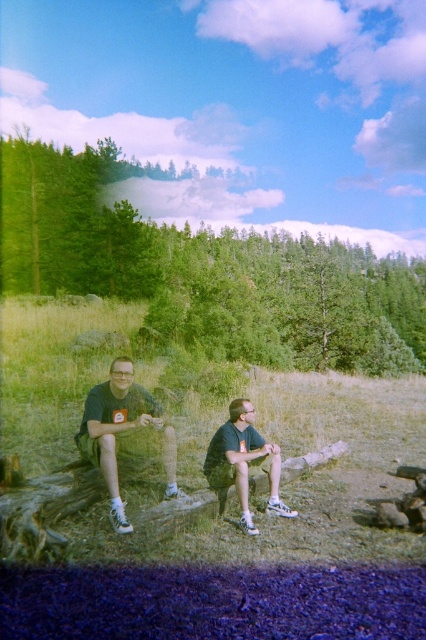
Is green leafy tree at upper left below matte black t-shirt at left?

Actually, green leafy tree at upper left is above matte black t-shirt at left.

Who is lower down, green leafy tree at upper left or matte black t-shirt at left?

matte black t-shirt at left is below.

This screenshot has height=640, width=426. In order to click on green leafy tree at upper left in this screenshot , I will do `click(199, 268)`.

Who is shorter, matte black t-shirt at left or dark green fabric shirt at center?

dark green fabric shirt at center is shorter.

Who is taller, matte black t-shirt at left or dark green fabric shirt at center?

With more height is matte black t-shirt at left.

Looking at this image, measure the distance between point (172,486) and camera.

Point (172,486) is 5.72 meters away from camera.

At what (x,y) coordinates should I click in order to perform the action: click on matte black t-shirt at left. Please return your answer as a coordinate pair (x, y). The height and width of the screenshot is (640, 426). Looking at the image, I should click on (123, 433).

Is green leafy tree at upper left smaller than dark green fabric shorts at center?

Actually, green leafy tree at upper left might be larger than dark green fabric shorts at center.

Between green leafy tree at upper left and dark green fabric shorts at center, which one is positioned higher?

green leafy tree at upper left is higher up.

The image size is (426, 640). In order to click on green leafy tree at upper left in this screenshot , I will do `click(199, 268)`.

Where is `green leafy tree at upper left`? green leafy tree at upper left is located at coordinates (199, 268).